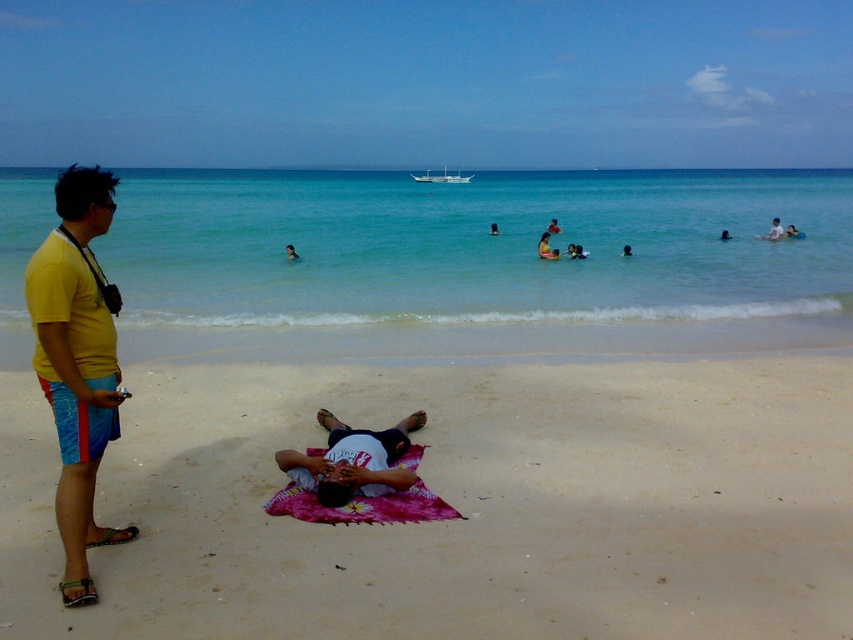
You are planning to set up a picnic on the beach and have two pink items available. You see the pink fabric at center and the pink fabric blanket at center in the image. Which one would you choose if you want to cover a larger area for your picnic setup?

The pink fabric blanket at center is the better choice because it occupies more space than the pink fabric at center, allowing for a larger picnic area.